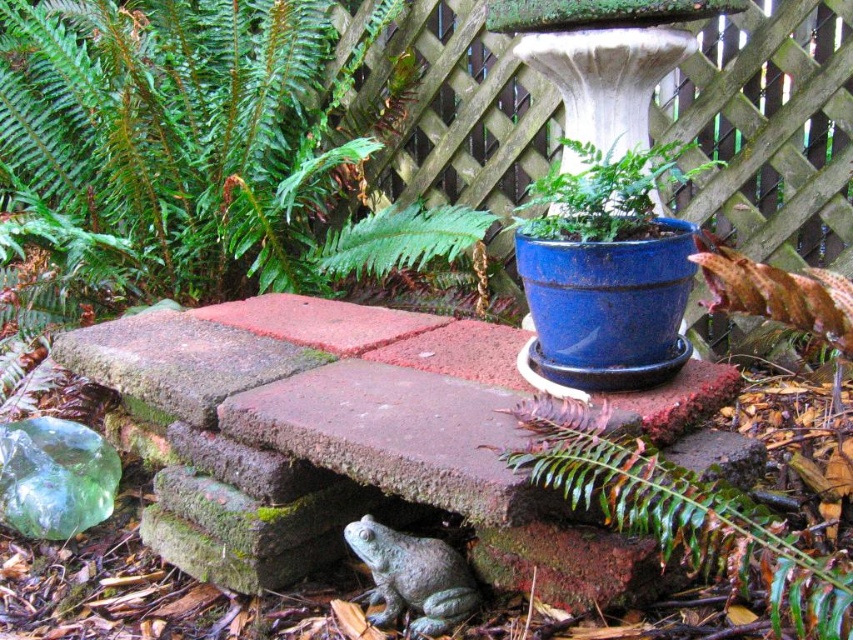
Looking at this image, you are standing in the garden and want to place a decorative stone near the green leafy fern at lower center. Based on its current position, where should you place the stone to ensure it is directly to the right of the fern?

The green leafy fern at lower center is located at point (683, 515). To place the stone directly to the right, you should position it at a coordinate with the same y value and a slightly higher x value, such as (683, 522).

What is located at the point with coordinates [683,515] in the garden scene?

The point at coordinates [683,515] marks the location of the green leafy fern at lower center.